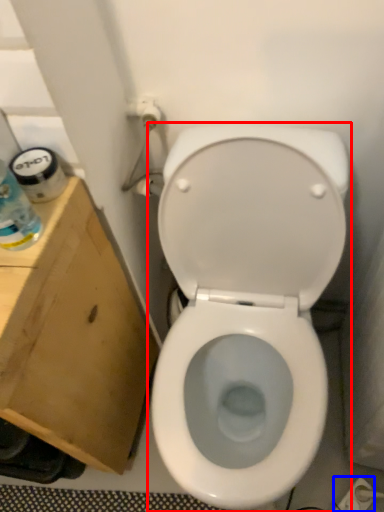
Question: Which of the following is the farthest to the observer, toilet (highlighted by a red box) or electric outlet (highlighted by a blue box)?

Choices:
 (A) toilet
 (B) electric outlet

Answer: (B)